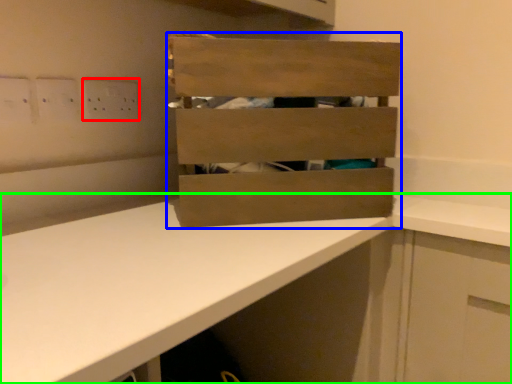
Question: Which object is the farthest from electric outlet (highlighted by a red box)? Choose among these: crate (highlighted by a blue box) or countertop (highlighted by a green box).

Choices:
 (A) crate
 (B) countertop

Answer: (B)